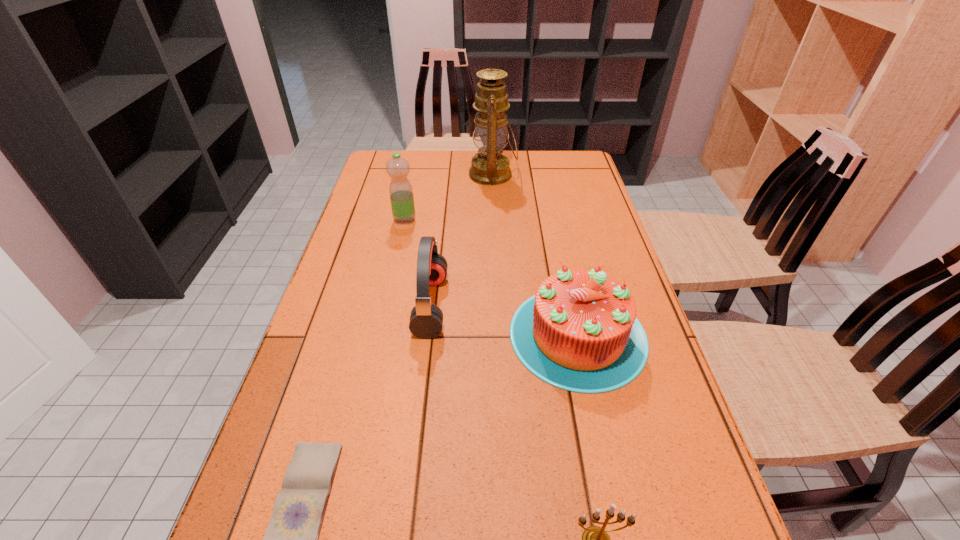
What are the coordinates of `the tallest object` in the screenshot? It's located at (491, 167).

The image size is (960, 540). Identify the location of the farthest object. (491, 167).

Where is `the fifth nearest object`? the fifth nearest object is located at coordinates (400, 189).

Where is `the second tallest object`? the second tallest object is located at coordinates 400,189.

At what (x,y) coordinates should I click in order to perform the action: click on the fourth object from right to left. Please return your answer as a coordinate pair (x, y). The width and height of the screenshot is (960, 540). Looking at the image, I should click on (426, 319).

Identify the location of cake. The height and width of the screenshot is (540, 960). (579, 332).

You are a GUI agent. You are given a task and a screenshot of the screen. Output one action in this format:
    pyautogui.click(x=<x>, y=<y>)
    Task: Click on the blank space located 0.220m on the right of the tallest object
    The height and width of the screenshot is (540, 960).
    Given the screenshot: What is the action you would take?
    pyautogui.click(x=577, y=174)

Where is `free region located 0.260m on the front of the second farthest object`? The height and width of the screenshot is (540, 960). free region located 0.260m on the front of the second farthest object is located at coordinates (391, 283).

Identify the location of vacant area situated 0.140m on the ear cups of the fourth object from right to left. Image resolution: width=960 pixels, height=540 pixels. (502, 305).

Where is `free space located on the left of the cake`? The width and height of the screenshot is (960, 540). free space located on the left of the cake is located at coordinates (348, 335).